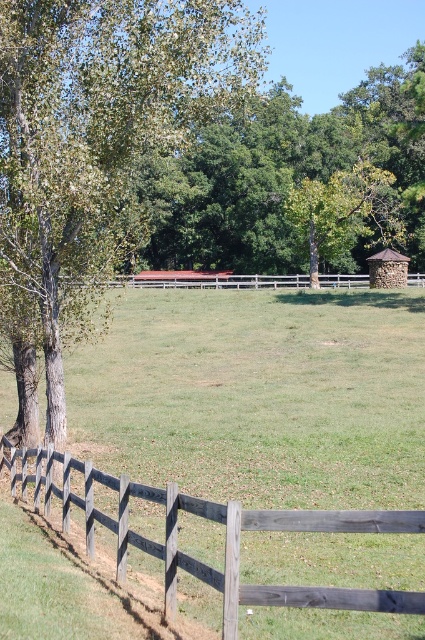
Who is higher up, green leafy tree at left or wooden fence at center?

green leafy tree at left

Can you confirm if green leafy tree at left is positioned to the right of wooden fence at center?

In fact, green leafy tree at left is to the left of wooden fence at center.

Is point (25, 90) less distant than point (402, 609)?

That is False.

Locate an element on the screen. This screenshot has height=640, width=425. green leafy tree at left is located at coordinates (99, 141).